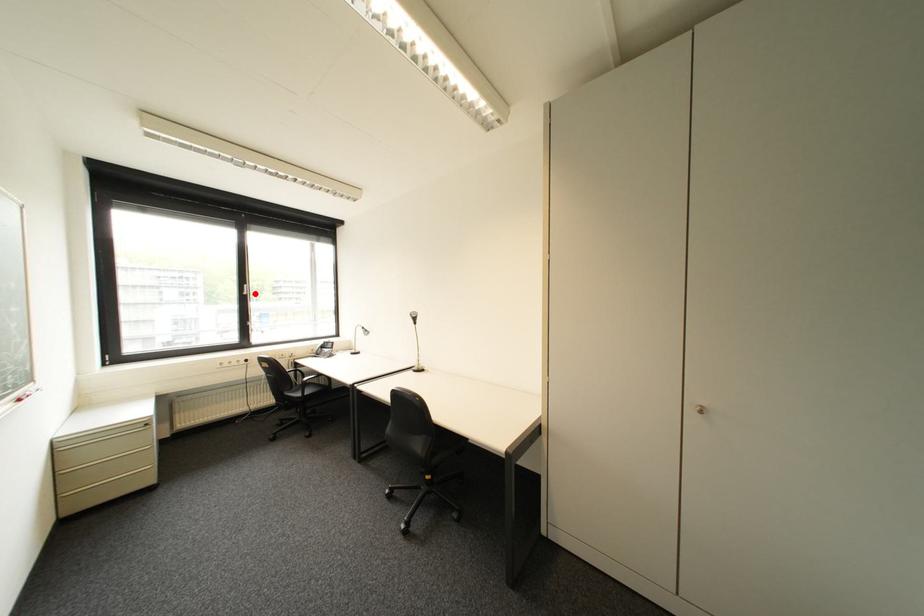
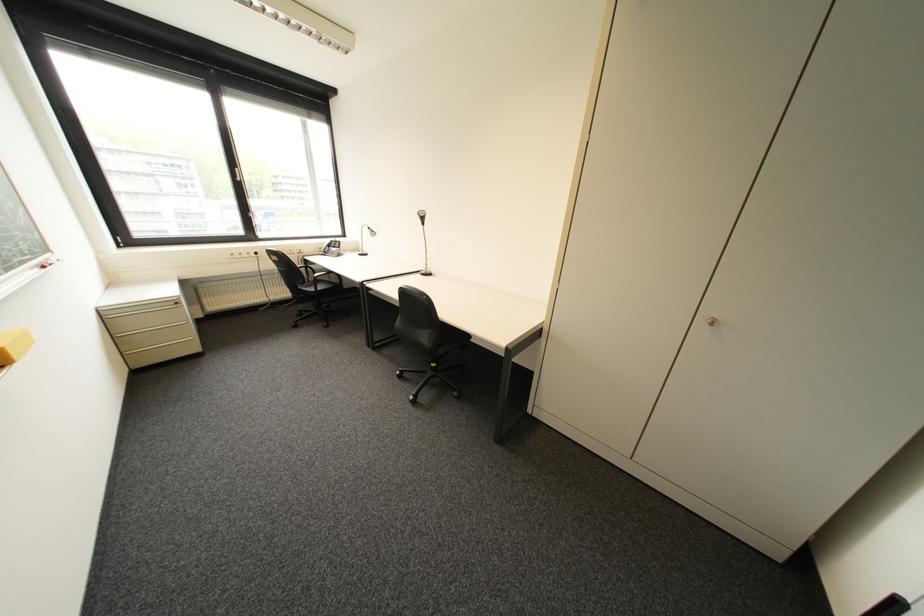
Question: I am providing you with two images of the same scene from different viewpoints. A red point is shown in image1. For the corresponding object point in image2, is it positioned nearer or farther from the camera?

Choices:
 (A) Nearer
 (B) Farther

Answer: (A)